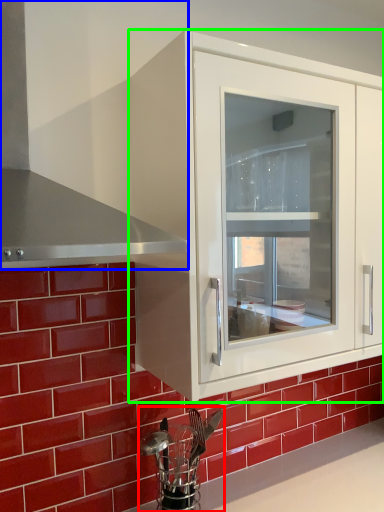
Question: Based on their relative distances, which object is nearer to appliance (highlighted by a red box)? Choose from exhaust hood (highlighted by a blue box) and cabinetry (highlighted by a green box).

Choices:
 (A) exhaust hood
 (B) cabinetry

Answer: (B)